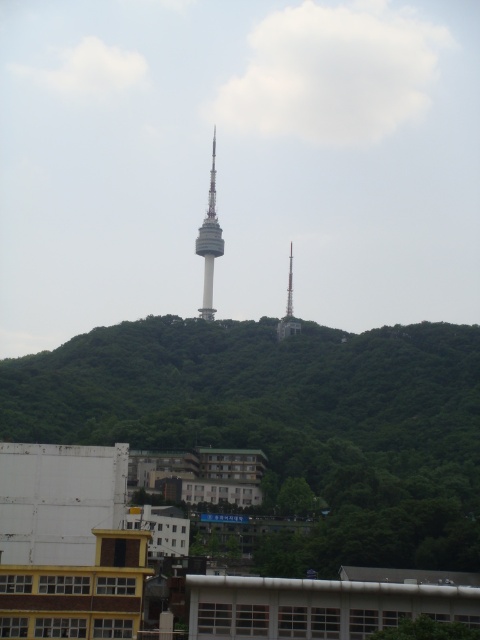
Question: Is green leafy hillside at center closer to camera compared to gray concrete tower at center?

Choices:
 (A) no
 (B) yes

Answer: (B)

Question: Is green leafy hillside at center positioned at the back of gray concrete tower at center?

Choices:
 (A) no
 (B) yes

Answer: (A)

Question: Among these objects, which one is nearest to the camera?

Choices:
 (A) green leafy hillside at center
 (B) gray concrete tower at center

Answer: (A)

Question: Can you confirm if green leafy hillside at center is smaller than gray concrete tower at center?

Choices:
 (A) yes
 (B) no

Answer: (B)